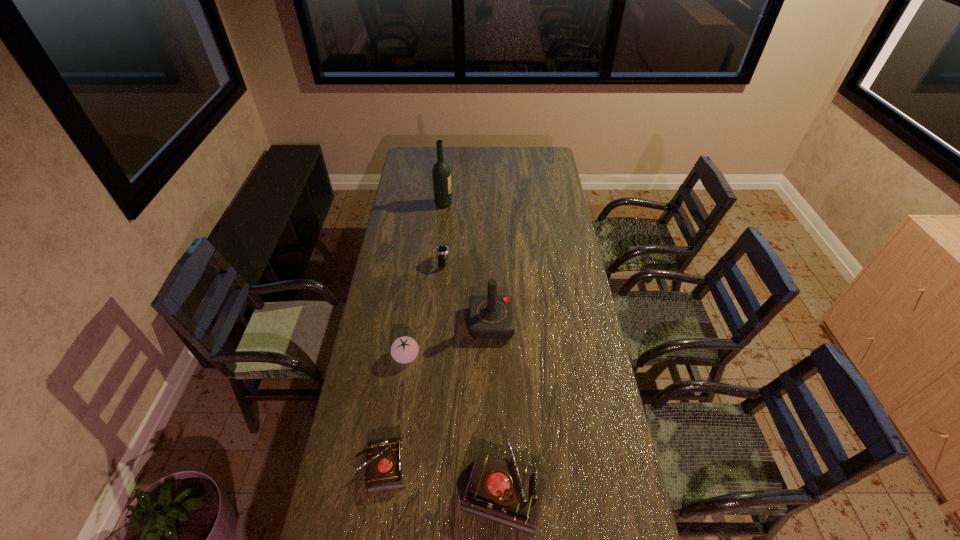
You are a GUI agent. You are given a task and a screenshot of the screen. Output one action in this format:
    pyautogui.click(x=<x>, y=<y>)
    Task: Click on the vacant area situated on the back of the taller diary
    This screenshot has width=960, height=540.
    Given the screenshot: What is the action you would take?
    pyautogui.click(x=502, y=428)

Where is `free space located 0.330m on the labeled side of the tallest object`? free space located 0.330m on the labeled side of the tallest object is located at coordinates (515, 204).

Identify the location of vacant space located on the right of the second farthest object. This screenshot has height=540, width=960. (473, 263).

Where is `vacant area situated 0.370m on the rectangular base of the joystick`? This screenshot has width=960, height=540. vacant area situated 0.370m on the rectangular base of the joystick is located at coordinates (378, 322).

Where is `free spot located 0.350m on the rectangular base of the joystick`? The image size is (960, 540). free spot located 0.350m on the rectangular base of the joystick is located at coordinates (383, 322).

Locate an element on the screen. vacant space located 0.080m on the rectangular base of the joystick is located at coordinates (450, 322).

Find the location of `free region located on the front of the tomato`. free region located on the front of the tomato is located at coordinates (391, 470).

Locate an element on the screen. Image resolution: width=960 pixels, height=540 pixels. object situated at the near edge is located at coordinates (501, 490).

I want to click on diary that is at the left edge, so click(385, 463).

Locate an element on the screen. Image resolution: width=960 pixels, height=540 pixels. tomato that is at the left edge is located at coordinates (405, 349).